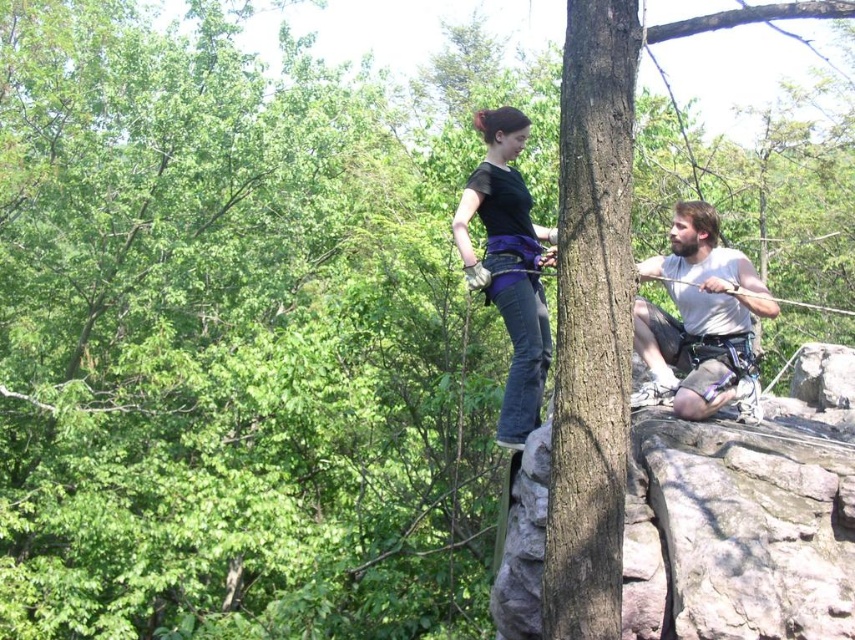
You are a photographer trying to capture both the light gray fabric shorts at right and the black matte pants at center in a single frame. Which clothing item should you focus on first to ensure it appears larger in the photo?

The black matte pants at center should be focused on first because it is larger than the light gray fabric shorts at right.